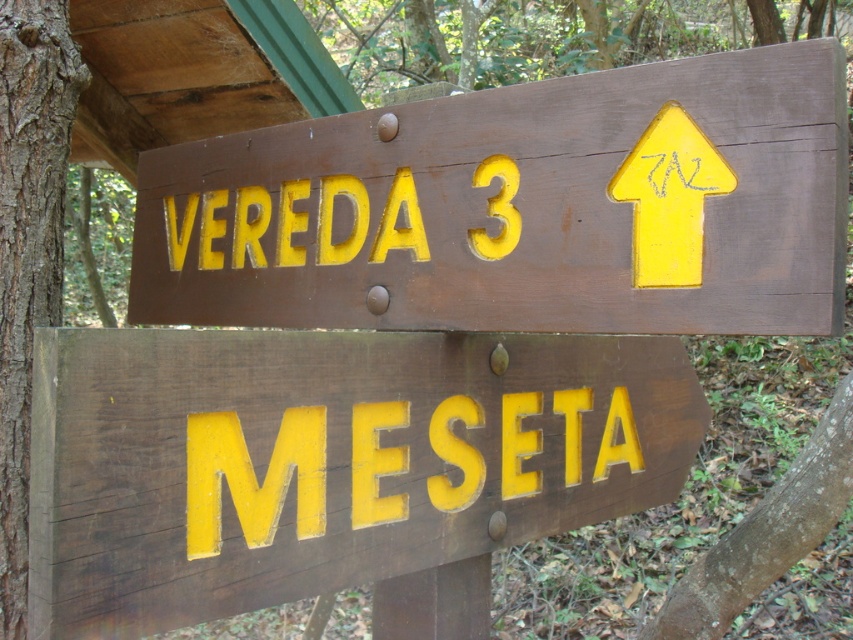
You are a hiker trying to read the directional signs in the forest. You notice two signs on a post. One is the matte brown sign at upper center and the other is the matte wood sign at center. Which sign do you think is closer to you?

The matte brown sign at upper center is closer to you because the matte wood sign at center is behind it.

You are standing in front of two wooden directional signs mounted on a post in a forest. The top sign says VEREDA 3 with an arrow pointing upwards, and the bottom sign says MESA. The point marked at coordinates (325,460) is on one of the signs. Which sign is the point on?

The point at coordinates (325,460) marks the matte wood sign at center, which is the top sign labeled VEREDA 3.

You are hiking in a forest and come across two signs. You need to read both signs from top to bottom. Which sign should you look at first, the matte brown sign at upper center or the matte wood sign at center?

The matte brown sign at upper center is above the matte wood sign at center, so you should look at the matte brown sign at upper center first.